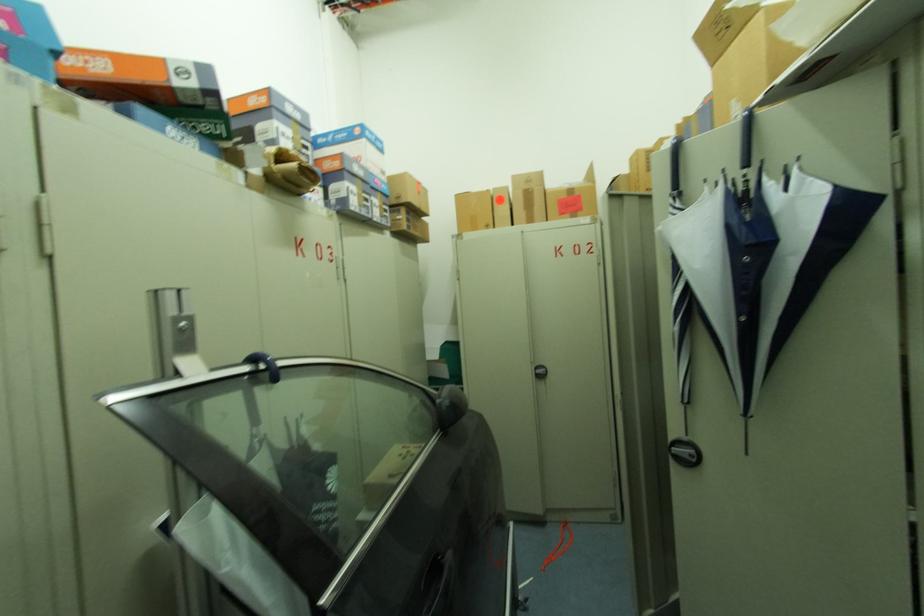
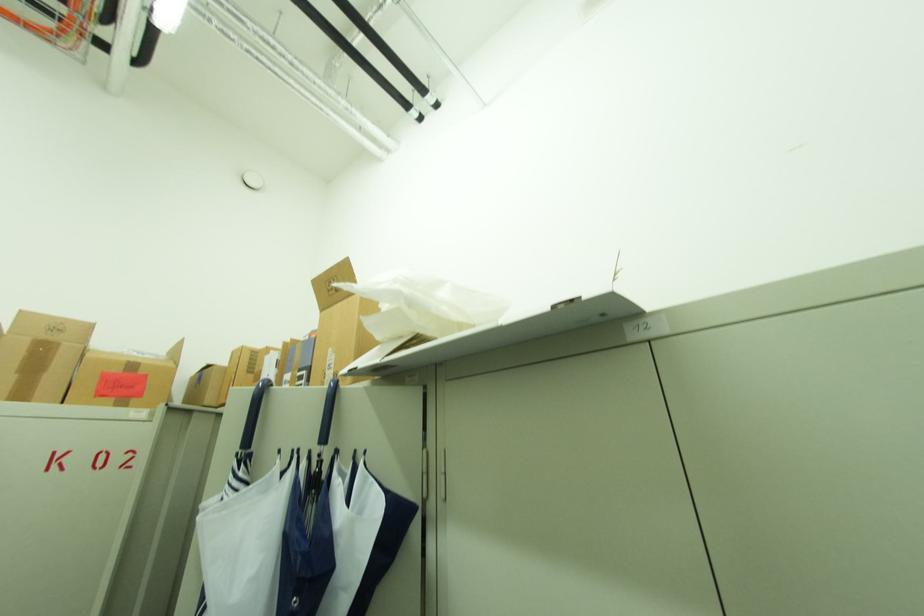
How did the camera likely rotate?

The camera rotated toward right-up.